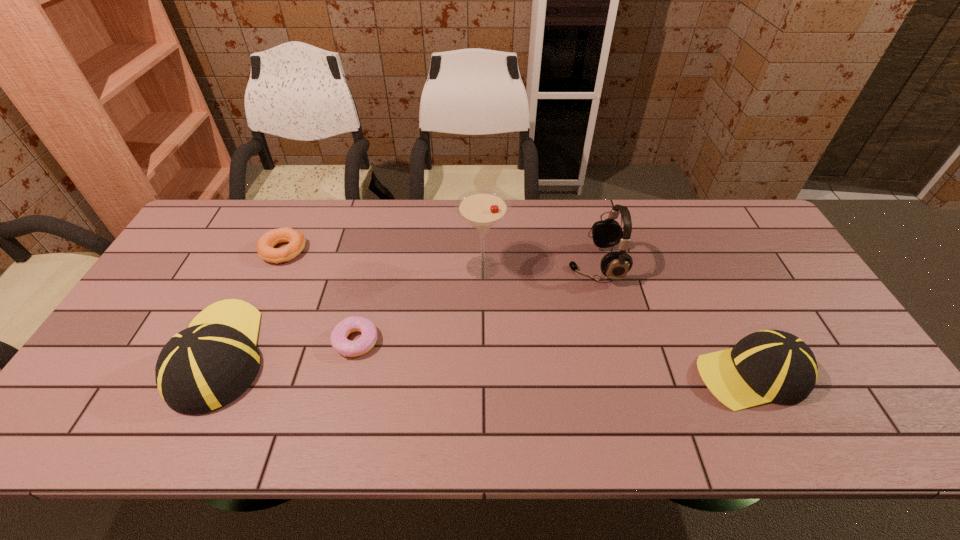
To achieve uniform spacing by inserting another baseball_cap among them, please point to a free space for this new baseball_cap. Please provide its 2D coordinates. Your answer should be formatted as a tuple, i.e. [(x, y)], where the tuple contains the x and y coordinates of a point satisfying the conditions above.

[(481, 364)]